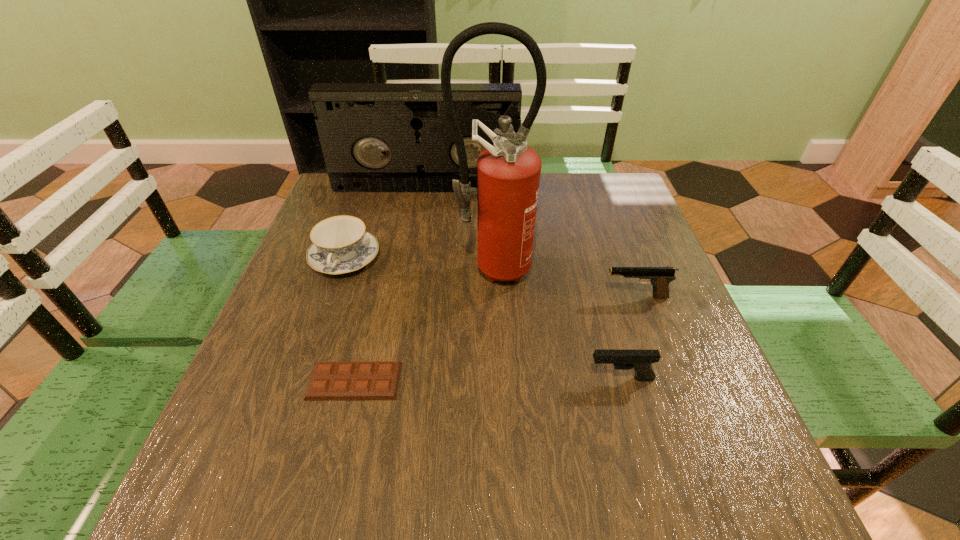
Locate an element on the screen. This screenshot has height=540, width=960. chocolate bar present at the left edge is located at coordinates (330, 380).

Identify the location of object that is positioned at the far left corner. This screenshot has height=540, width=960. (376, 137).

In the image, there is a desktop. Where is `vacant space at the far edge`? vacant space at the far edge is located at coordinates (555, 199).

I want to click on vacant area at the left edge of the desktop, so click(x=315, y=315).

In the image, there is a desktop. In order to click on vacant space at the right edge in this screenshot , I will do `click(612, 305)`.

At what (x,y) coordinates should I click in order to perform the action: click on free space at the far left corner of the desktop. Please return your answer as a coordinate pair (x, y). Looking at the image, I should click on (359, 214).

This screenshot has width=960, height=540. In the image, there is a desktop. Find the location of `free space at the near left corner`. free space at the near left corner is located at coordinates coord(204,484).

Where is `free space between the chinaware and the fire extinguisher`? The image size is (960, 540). free space between the chinaware and the fire extinguisher is located at coordinates (418, 264).

Image resolution: width=960 pixels, height=540 pixels. I want to click on vacant space that is in between the chinaware and the farthest object, so click(385, 223).

Where is `unoccupied position between the shortest object and the chinaware`? The image size is (960, 540). unoccupied position between the shortest object and the chinaware is located at coordinates (349, 320).